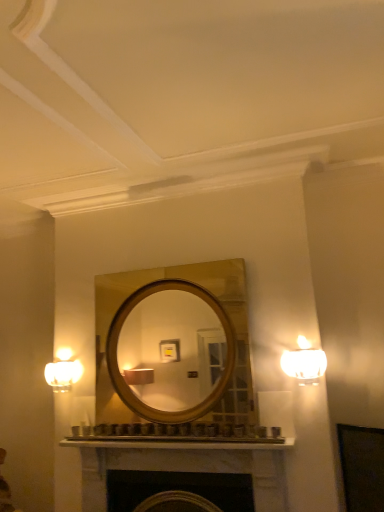
What do you see at coordinates (63, 371) in the screenshot?
I see `matte white sconce at left` at bounding box center [63, 371].

Measure the distance between point [271,484] and camera.

The distance of point [271,484] from camera is 2.43 meters.

Where is `matte white sconce at left`? matte white sconce at left is located at coordinates (63, 371).

Would you say white marble fireplace at lower center is a long distance from white frosted glass lamp at right?

white marble fireplace at lower center is near white frosted glass lamp at right, not far away.

Considering the sizes of objects white marble fireplace at lower center and white frosted glass lamp at right in the image provided, who is thinner, white marble fireplace at lower center or white frosted glass lamp at right?

white frosted glass lamp at right.

From a real-world perspective, is white marble fireplace at lower center physically below white frosted glass lamp at right?

Yes, from a real-world perspective, white marble fireplace at lower center is under white frosted glass lamp at right.

How many degrees apart are the facing directions of white marble fireplace at lower center and white frosted glass lamp at right?

The angular difference between white marble fireplace at lower center and white frosted glass lamp at right is 0.621 degrees.

In the image, is matte white sconce at left on the left side or the right side of white frosted glass lamp at right?

matte white sconce at left is positioned on white frosted glass lamp at right's left side.

Are matte white sconce at left and white frosted glass lamp at right located far from each other?

Yes, matte white sconce at left and white frosted glass lamp at right are quite far apart.

Considering the sizes of matte white sconce at left and white frosted glass lamp at right in the image, is matte white sconce at left taller or shorter than white frosted glass lamp at right?

Considering their sizes, matte white sconce at left has less height than white frosted glass lamp at right.

Would you say white frosted glass lamp at right is to the left or to the right of white marble fireplace at lower center in the picture?

white frosted glass lamp at right is positioned on white marble fireplace at lower center's right side.

Which of these two, white frosted glass lamp at right or white marble fireplace at lower center, stands shorter?

white frosted glass lamp at right.

From a real-world perspective, which object rests below the other?

From a 3D spatial view, white marble fireplace at lower center is below.

Is point (306, 376) positioned before point (95, 489)?

That is True.

In terms of size, does white marble fireplace at lower center appear bigger or smaller than matte white sconce at left?

Clearly, white marble fireplace at lower center is larger in size than matte white sconce at left.

From the picture: Is white marble fireplace at lower center facing away from matte white sconce at left?

white marble fireplace at lower center is not turned away from matte white sconce at left.

Is white marble fireplace at lower center completely or partially outside of matte white sconce at left?

white marble fireplace at lower center is positioned outside matte white sconce at left.

Identify the location of fixture above the white marble fireplace at lower center (from a real-world perspective). This screenshot has height=512, width=384. (63, 371).

From the image's perspective, is matte white sconce at left located above or below white marble fireplace at lower center?

matte white sconce at left is situated higher than white marble fireplace at lower center in the image.

In the scene shown: Is the position of matte white sconce at left less distant than that of white marble fireplace at lower center?

No, it is not.

Can you confirm if matte white sconce at left is smaller than white marble fireplace at lower center?

Yes, matte white sconce at left is smaller than white marble fireplace at lower center.

From a real-world perspective, is matte white sconce at left over white marble fireplace at lower center?

Yes, from a real-world perspective, matte white sconce at left is above white marble fireplace at lower center.

Who is smaller, white frosted glass lamp at right or matte white sconce at left?

matte white sconce at left.

Considering the relative sizes of white frosted glass lamp at right and matte white sconce at left in the image provided, is white frosted glass lamp at right wider than matte white sconce at left?

Correct, the width of white frosted glass lamp at right exceeds that of matte white sconce at left.

From the image's perspective, which one is positioned higher, white frosted glass lamp at right or matte white sconce at left?

white frosted glass lamp at right.

Is point (310, 349) more distant than point (49, 367)?

No, (310, 349) is in front of (49, 367).

Where is `fireplace that appears in front of the white frosted glass lamp at right`? fireplace that appears in front of the white frosted glass lamp at right is located at coordinates (183, 465).

You are a GUI agent. You are given a task and a screenshot of the screen. Output one action in this format:
    pyautogui.click(x=<x>, y=<y>)
    Task: Click on the fixture below the white frosted glass lamp at right (from a real-world perspective)
    The width and height of the screenshot is (384, 512).
    Given the screenshot: What is the action you would take?
    pyautogui.click(x=63, y=371)

Considering their positions, is white marble fireplace at lower center positioned closer to matte white sconce at left than white frosted glass lamp at right?

Based on the image, white marble fireplace at lower center appears to be nearer to matte white sconce at left.

From the image, which object appears to be farther from matte white sconce at left, white frosted glass lamp at right or white marble fireplace at lower center?

Among the two, white frosted glass lamp at right is located further to matte white sconce at left.

When comparing their distances from white marble fireplace at lower center, does white frosted glass lamp at right or matte white sconce at left seem closer?

Based on the image, white frosted glass lamp at right appears to be nearer to white marble fireplace at lower center.

From the image, which object appears to be farther from white frosted glass lamp at right, matte white sconce at left or white marble fireplace at lower center?

The object further to white frosted glass lamp at right is matte white sconce at left.

Which object lies further to the anchor point white frosted glass lamp at right, white marble fireplace at lower center or matte white sconce at left?

matte white sconce at left lies further to white frosted glass lamp at right than the other object.

Estimate the real-world distances between objects in this image. Which object is further from white marble fireplace at lower center, matte white sconce at left or white frosted glass lamp at right?

matte white sconce at left.

Locate an element on the screen. The width and height of the screenshot is (384, 512). fireplace between matte white sconce at left and white frosted glass lamp at right is located at coordinates (183, 465).